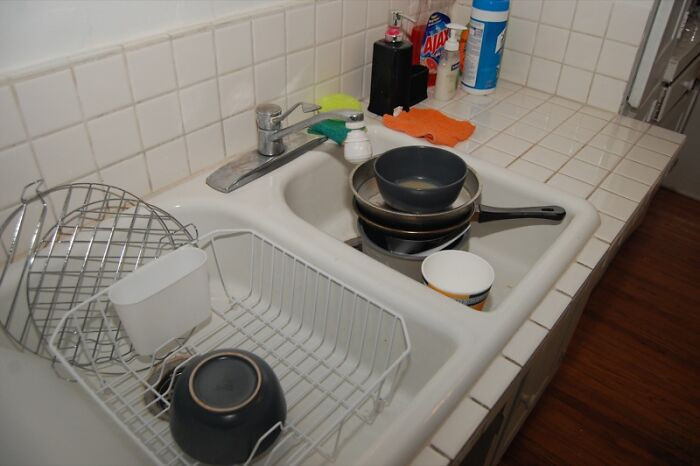
Find the location of `bowl`. bowl is located at coordinates (424, 177), (234, 376).